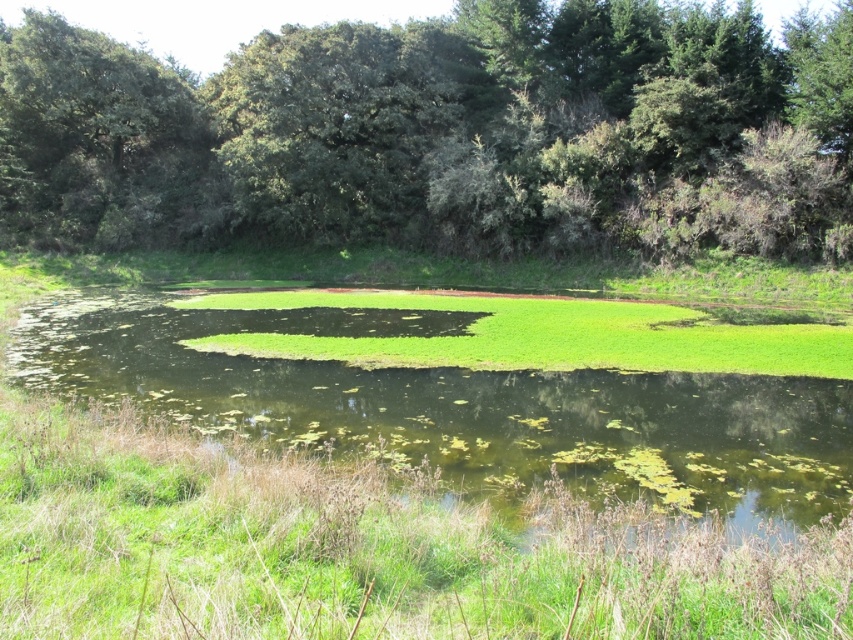
Question: Considering the relative positions of green leafy trees at upper center and green leafy tree at upper left in the image provided, where is green leafy trees at upper center located with respect to green leafy tree at upper left?

Choices:
 (A) below
 (B) above

Answer: (A)

Question: Among these objects, which one is farthest from the camera?

Choices:
 (A) green leafy tree at upper left
 (B) green leafy trees at upper center
 (C) green algae at center

Answer: (A)

Question: Which point is closer to the camera taking this photo?

Choices:
 (A) (699, 412)
 (B) (143, 106)

Answer: (A)

Question: Does green leafy trees at upper center have a larger size compared to green leafy tree at upper left?

Choices:
 (A) no
 (B) yes

Answer: (B)

Question: Is green leafy trees at upper center bigger than green algae at center?

Choices:
 (A) yes
 (B) no

Answer: (A)

Question: Which of the following is the closest to the observer?

Choices:
 (A) (229, 237)
 (B) (146, 125)

Answer: (A)